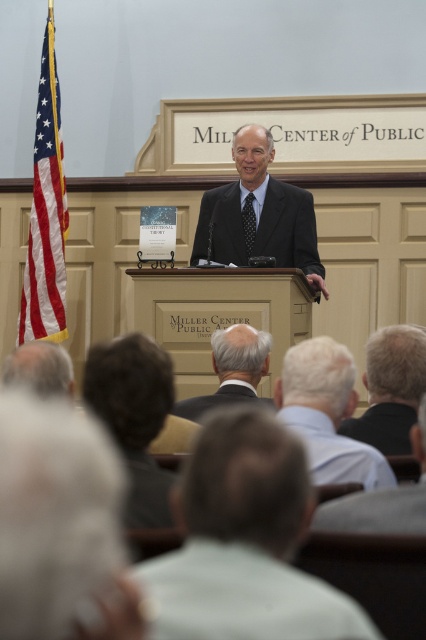
Question: Can you confirm if gray hair at lower left is bigger than black dotted tie at center?

Choices:
 (A) no
 (B) yes

Answer: (B)

Question: Which of these objects is positioned farthest from the gray hair at upper right?

Choices:
 (A) light gray suit at center
 (B) gray hair man at center
 (C) gray hair at lower left
 (D) matte black suit at center

Answer: (D)

Question: Considering the relative positions of matte black suit at center and gray hair at upper right in the image provided, where is matte black suit at center located with respect to gray hair at upper right?

Choices:
 (A) above
 (B) below

Answer: (A)

Question: Estimate the real-world distances between objects in this image. Which object is farther from the light gray shirt at lower center?

Choices:
 (A) gray hair at lower left
 (B) gray hair at upper right

Answer: (A)

Question: Based on their relative distances, which object is nearer to the black dotted tie at center?

Choices:
 (A) light gray suit at center
 (B) matte black suit at center
 (C) gray hair at upper right

Answer: (B)

Question: Does gray fabric head at lower left appear on the left side of gray hair at upper right?

Choices:
 (A) no
 (B) yes

Answer: (B)